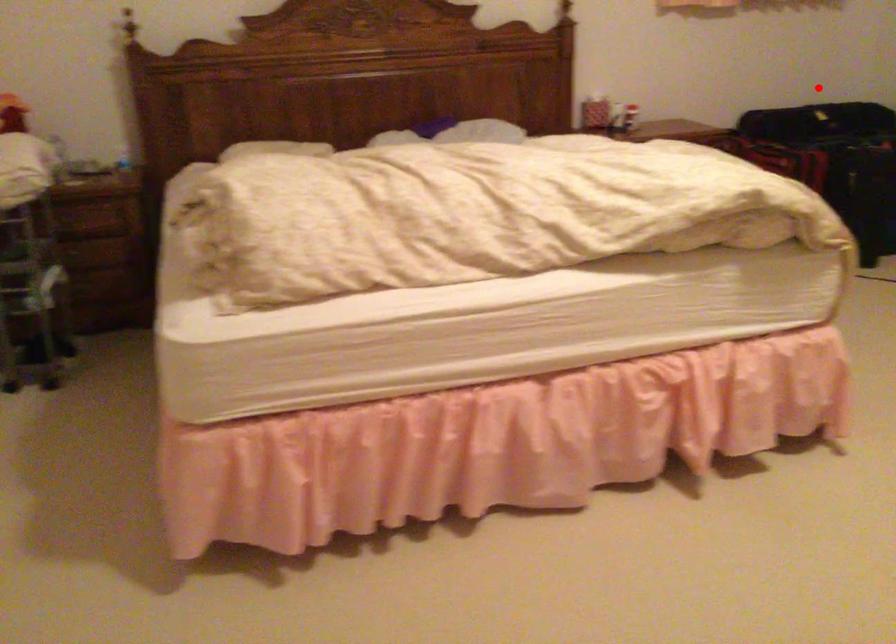
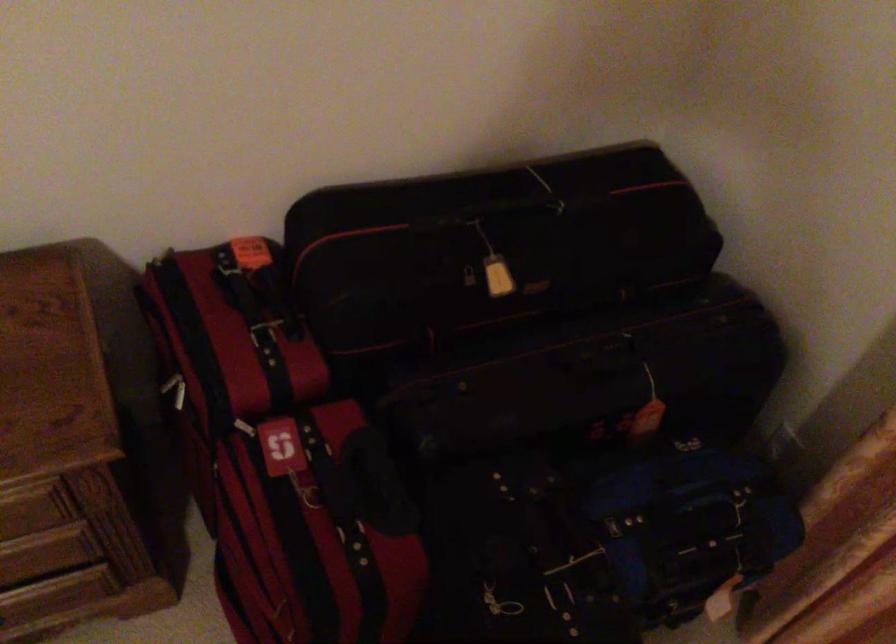
Question: I am providing you with two images of the same scene from different viewpoints. In image1, a red point is highlighted. Considering the same 3D point in image2, which of the following is correct?

Choices:
 (A) It is closer
 (B) It is farther

Answer: (A)